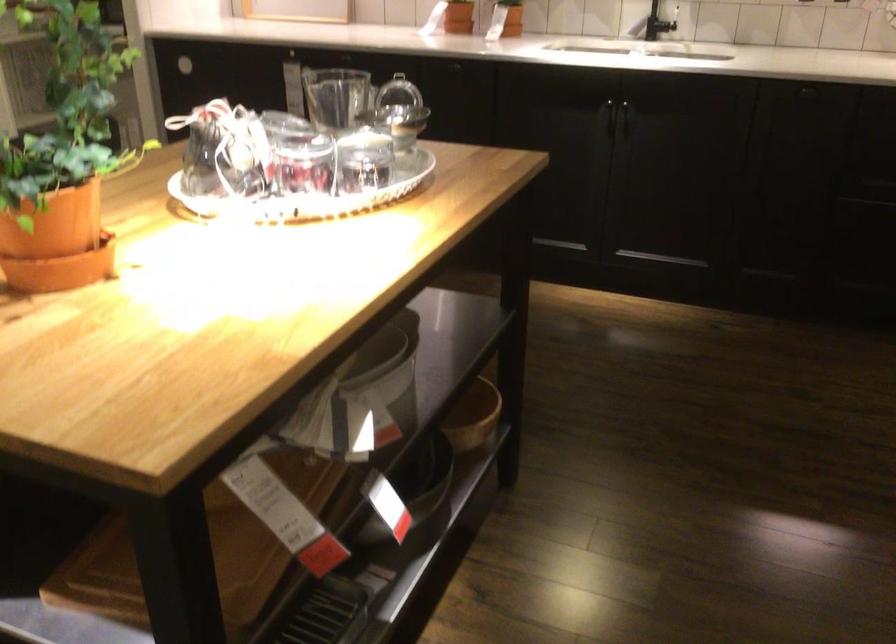
This screenshot has width=896, height=644. Find the location of `faucet handle`. faucet handle is located at coordinates (652, 24).